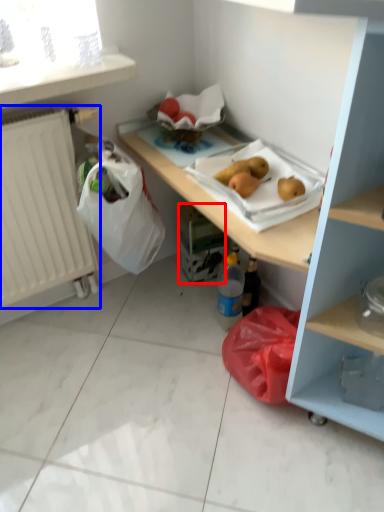
Question: Among these objects, which one is nearest to the camera, carton (highlighted by a red box) or radiator (highlighted by a blue box)?

Choices:
 (A) carton
 (B) radiator

Answer: (B)